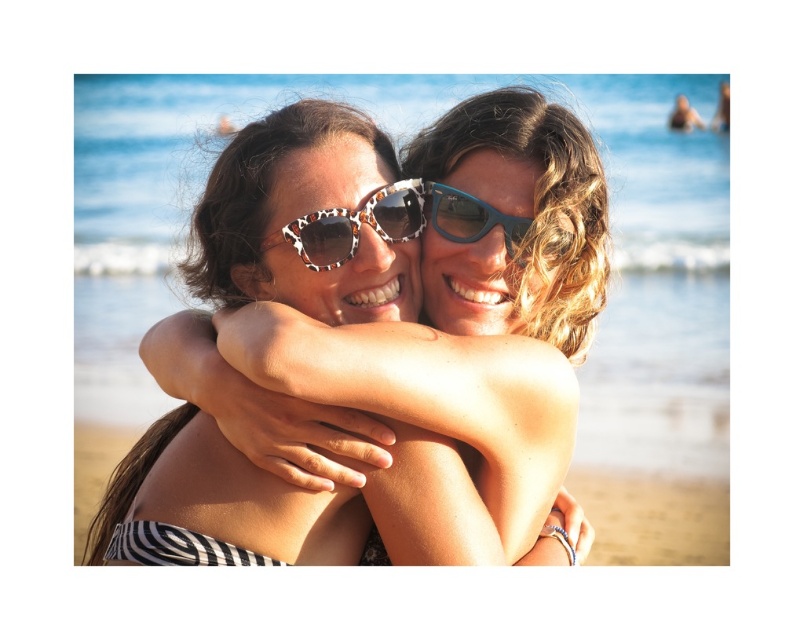
Question: Which of these objects is positioned farthest from the blue plastic goggles at center?

Choices:
 (A) leopard print acetate sunglasses at center
 (B) matte black bikini top at center

Answer: (B)

Question: Which object is positioned farthest from the leopard print acetate sunglasses at center?

Choices:
 (A) sandy tan skin at center
 (B) blue plastic goggles at center
 (C) matte black bikini top at center

Answer: (A)

Question: Can you confirm if matte black bikini top at center is thinner than blue plastic goggles at center?

Choices:
 (A) no
 (B) yes

Answer: (A)

Question: Is leopard print acetate sunglasses at center thinner than blue plastic goggles at center?

Choices:
 (A) yes
 (B) no

Answer: (B)

Question: Is sandy tan skin at center to the right of leopard print acetate sunglasses at center from the viewer's perspective?

Choices:
 (A) no
 (B) yes

Answer: (A)

Question: Based on their relative distances, which object is farther from the sandy tan skin at center?

Choices:
 (A) blue plastic goggles at center
 (B) leopard print acetate sunglasses at center
 (C) matte black bikini top at center

Answer: (B)